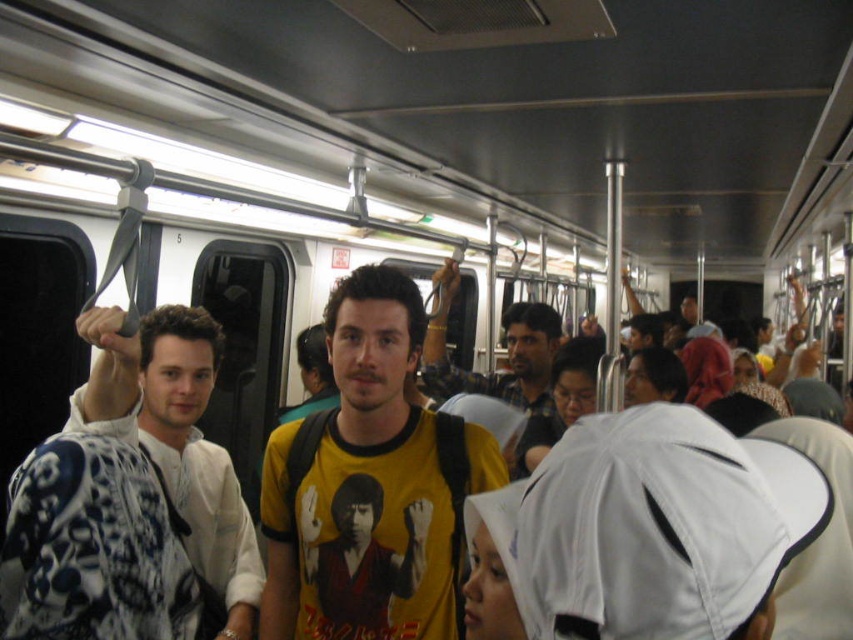
Is white textured shirt at left thinner than yellow printed t-shirt at center?

Correct, white textured shirt at left's width is less than yellow printed t-shirt at center's.

Between point (86, 316) and point (550, 308), which one is positioned in front?

Point (86, 316)

Where is `white textured shirt at left`? white textured shirt at left is located at coordinates (177, 442).

Does yellow matte t-shirt at center appear on the right side of white textured shirt at left?

Indeed, yellow matte t-shirt at center is positioned on the right side of white textured shirt at left.

This screenshot has width=853, height=640. I want to click on yellow matte t-shirt at center, so click(370, 484).

Who is taller, yellow matte t-shirt at center or yellow printed t-shirt at center?

yellow matte t-shirt at center is taller.

From the picture: Is yellow matte t-shirt at center wider than yellow printed t-shirt at center?

Incorrect, yellow matte t-shirt at center's width does not surpass yellow printed t-shirt at center's.

Does point (358, 355) come closer to viewer compared to point (538, 394)?

Yes, it is in front of point (538, 394).

I want to click on yellow matte t-shirt at center, so click(370, 484).